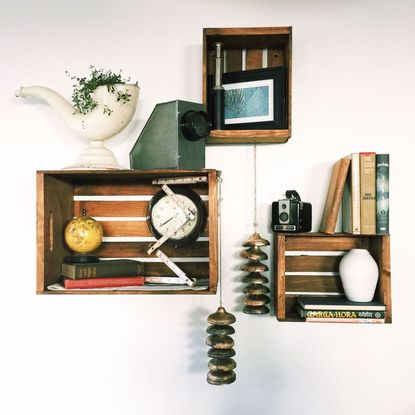
Identify the location of book. (383, 200).